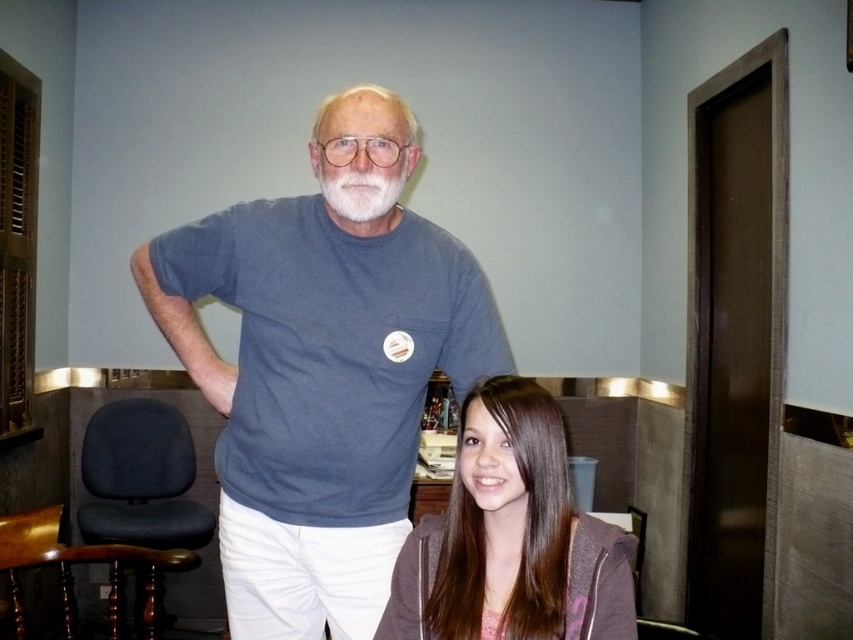
Based on the photo, is matte blue t-shirt at center bigger than white matte beard at upper center?

Indeed, matte blue t-shirt at center has a larger size compared to white matte beard at upper center.

Does matte blue t-shirt at center appear under white matte beard at upper center?

Yes.

Between point (206, 228) and point (358, 204), which one is positioned in front?

Point (358, 204)

Identify the location of matte blue t-shirt at center. (318, 392).

Who is positioned more to the left, matte blue t-shirt at center or smooth brown hair at lower center?

From the viewer's perspective, matte blue t-shirt at center appears more on the left side.

Which is more to the right, matte blue t-shirt at center or smooth brown hair at lower center?

smooth brown hair at lower center

The height and width of the screenshot is (640, 853). Find the location of `matte blue t-shirt at center`. matte blue t-shirt at center is located at coordinates (318, 392).

Between smooth brown hair at lower center and white matte beard at upper center, which one is positioned lower?

smooth brown hair at lower center is below.

Does smooth brown hair at lower center have a greater height compared to white matte beard at upper center?

Indeed, smooth brown hair at lower center has a greater height compared to white matte beard at upper center.

Identify the location of smooth brown hair at lower center. (511, 536).